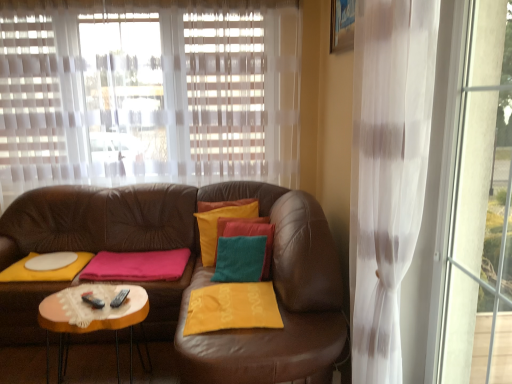
Question: Is leather couch at center smaller than translucent white curtain at upper center?

Choices:
 (A) yes
 (B) no

Answer: (B)

Question: Is translucent white curtain at upper center a part of leather couch at center?

Choices:
 (A) no
 (B) yes

Answer: (A)

Question: Does leather couch at center have a larger size compared to translucent white curtain at upper center?

Choices:
 (A) no
 (B) yes

Answer: (B)

Question: From a real-world perspective, does leather couch at center sit lower than translucent white curtain at upper center?

Choices:
 (A) no
 (B) yes

Answer: (B)

Question: Is leather couch at center to the left of translucent white curtain at upper center from the viewer's perspective?

Choices:
 (A) no
 (B) yes

Answer: (B)

Question: Can you confirm if leather couch at center is positioned to the right of translucent white curtain at upper center?

Choices:
 (A) yes
 (B) no

Answer: (B)

Question: Is translucent white curtain at upper center in front of leather couch at center?

Choices:
 (A) yes
 (B) no

Answer: (B)

Question: Can you confirm if translucent white curtain at upper center is taller than leather couch at center?

Choices:
 (A) no
 (B) yes

Answer: (A)

Question: Does translucent white curtain at upper center appear on the right side of leather couch at center?

Choices:
 (A) yes
 (B) no

Answer: (A)

Question: Are translucent white curtain at upper center and leather couch at center beside each other?

Choices:
 (A) no
 (B) yes

Answer: (A)

Question: Is leather couch at center located within translucent white curtain at upper center?

Choices:
 (A) no
 (B) yes

Answer: (A)

Question: From the image's perspective, is translucent white curtain at upper center beneath leather couch at center?

Choices:
 (A) yes
 (B) no

Answer: (B)

Question: In terms of height, does translucent white curtain at upper center look taller or shorter compared to leather couch at center?

Choices:
 (A) tall
 (B) short

Answer: (B)